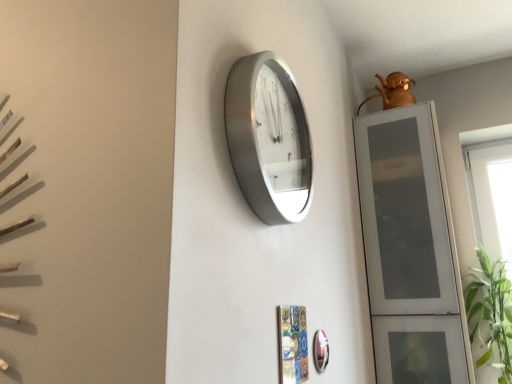
Describe the element at coordinates (320, 351) in the screenshot. I see `shiny silver mirror at lower center` at that location.

At what (x,y) coordinates should I click in order to perform the action: click on transparent glass cabinet at right. Please return your answer as a coordinate pair (x, y). This screenshot has width=512, height=384. Looking at the image, I should click on (410, 249).

Identify the location of satin silver clock at center. (268, 138).

Is shiny silver mirror at lower center to the left or to the right of satin silver clock at center in the image?

Based on their positions, shiny silver mirror at lower center is located to the right of satin silver clock at center.

Is shiny silver mirror at lower center looking in the opposite direction of satin silver clock at center?

shiny silver mirror at lower center is not turned away from satin silver clock at center.

From the image's perspective, which is above, shiny silver mirror at lower center or satin silver clock at center?

satin silver clock at center appears higher in the image.

From the image's perspective, relative to transparent glass cabinet at right, is satin silver clock at center above or below?

Clearly, from the image's perspective, satin silver clock at center is above transparent glass cabinet at right.

Is satin silver clock at center not within transparent glass cabinet at right?

Yes, satin silver clock at center is not within transparent glass cabinet at right.

How many degrees apart are the facing directions of satin silver clock at center and transparent glass cabinet at right?

The angular difference between satin silver clock at center and transparent glass cabinet at right is 91.4 degrees.

Considering the positions of point (294, 130) and point (373, 342), is point (294, 130) closer or farther from the camera than point (373, 342)?

Point (294, 130) appears to be closer to the viewer than point (373, 342).

Considering the relative positions of transparent glass window at right and transparent glass cabinet at right in the image provided, is transparent glass window at right to the left or to the right of transparent glass cabinet at right?

Clearly, transparent glass window at right is on the right of transparent glass cabinet at right in the image.

Measure the distance from transparent glass window at right to transparent glass cabinet at right.

19.43 inches.

The width and height of the screenshot is (512, 384). I want to click on window that appears on the right of transparent glass cabinet at right, so click(x=490, y=255).

Between transparent glass window at right and transparent glass cabinet at right, which one has smaller width?

transparent glass window at right.

From a real-world perspective, between shiny silver mirror at lower center and transparent glass window at right, who is vertically lower?

shiny silver mirror at lower center is physically lower.

Does point (321, 331) appear closer or farther from the camera than point (483, 212)?

Clearly, point (321, 331) is closer to the camera than point (483, 212).

There is a shiny silver mirror at lower center. Find the location of `window above it (from a real-world perspective)`. window above it (from a real-world perspective) is located at coordinates (490, 255).

Based on the photo, is shiny silver mirror at lower center turned away from transparent glass window at right?

No, shiny silver mirror at lower center's orientation is not away from transparent glass window at right.

Is transparent glass cabinet at right far from transparent glass window at right?

transparent glass cabinet at right is near transparent glass window at right, not far away.

Who is shorter, transparent glass cabinet at right or transparent glass window at right?

transparent glass cabinet at right is shorter.

From a real-world perspective, is transparent glass cabinet at right under transparent glass window at right?

Actually, transparent glass cabinet at right is physically above transparent glass window at right in the real world.

Who is more distant, transparent glass cabinet at right or transparent glass window at right?

transparent glass window at right is more distant.

Is transparent glass window at right aimed at satin silver clock at center?

No, transparent glass window at right does not turn towards satin silver clock at center.

Considering the sizes of objects transparent glass window at right and satin silver clock at center in the image provided, who is bigger, transparent glass window at right or satin silver clock at center?

Bigger between the two is transparent glass window at right.

Is transparent glass window at right directly adjacent to satin silver clock at center?

No, transparent glass window at right is not making contact with satin silver clock at center.

Does point (504, 159) appear closer or farther from the camera than point (268, 182)?

Clearly, point (504, 159) is more distant from the camera than point (268, 182).

Is transparent glass cabinet at right aimed at shiny silver mirror at lower center?

Yes, transparent glass cabinet at right is facing shiny silver mirror at lower center.

Who is smaller, transparent glass cabinet at right or shiny silver mirror at lower center?

Smaller between the two is shiny silver mirror at lower center.

Locate an element on the screen. This screenshot has width=512, height=384. glass door above the shiny silver mirror at lower center (from a real-world perspective) is located at coordinates (410, 249).

Considering the sizes of objects transparent glass cabinet at right and shiny silver mirror at lower center in the image provided, who is thinner, transparent glass cabinet at right or shiny silver mirror at lower center?

shiny silver mirror at lower center.

Where is `mirror located below the satin silver clock at center (from the image's perspective)`? mirror located below the satin silver clock at center (from the image's perspective) is located at coordinates (320, 351).

Find the location of a particular element. The height and width of the screenshot is (384, 512). wall clock located above the transparent glass cabinet at right (from the image's perspective) is located at coordinates (268, 138).

When comparing their distances from shiny silver mirror at lower center, does transparent glass window at right or satin silver clock at center seem further?

transparent glass window at right.

When comparing their distances from satin silver clock at center, does transparent glass window at right or transparent glass cabinet at right seem further?

transparent glass window at right is positioned further to the anchor satin silver clock at center.

Which object lies nearer to the anchor point satin silver clock at center, shiny silver mirror at lower center or transparent glass cabinet at right?

shiny silver mirror at lower center is closer to satin silver clock at center.

Based on their spatial positions, is satin silver clock at center or shiny silver mirror at lower center further from transparent glass cabinet at right?

Based on the image, satin silver clock at center appears to be further to transparent glass cabinet at right.

Based on their spatial positions, is transparent glass window at right or satin silver clock at center closer to transparent glass cabinet at right?

transparent glass window at right.

Which object lies nearer to the anchor point shiny silver mirror at lower center, satin silver clock at center or transparent glass window at right?

satin silver clock at center.

From the image, which object appears to be nearer to transparent glass cabinet at right, transparent glass window at right or shiny silver mirror at lower center?

transparent glass window at right lies closer to transparent glass cabinet at right than the other object.

Considering their positions, is shiny silver mirror at lower center positioned closer to transparent glass cabinet at right than satin silver clock at center?

Among the two, shiny silver mirror at lower center is located nearer to transparent glass cabinet at right.

This screenshot has height=384, width=512. Identify the location of glass door between satin silver clock at center and transparent glass window at right from left to right. (410, 249).

At what (x,y) coordinates should I click in order to perform the action: click on mirror between satin silver clock at center and transparent glass window at right from left to right. Please return your answer as a coordinate pair (x, y). Looking at the image, I should click on (320, 351).

The height and width of the screenshot is (384, 512). I want to click on mirror located between satin silver clock at center and transparent glass cabinet at right in the depth direction, so click(320, 351).

The image size is (512, 384). What are the coordinates of `glass door located between shiny silver mirror at lower center and transparent glass window at right in the left-right direction` in the screenshot? It's located at (410, 249).